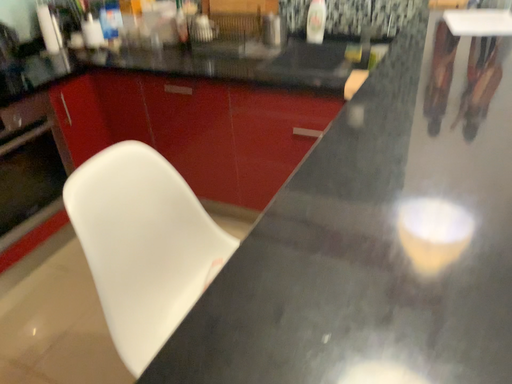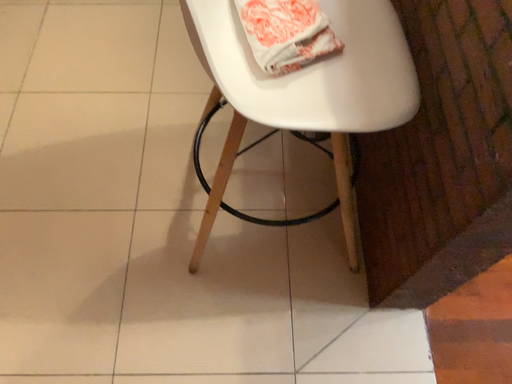
Question: How did the camera likely rotate when shooting the video?

Choices:
 (A) rotated right
 (B) rotated left

Answer: (A)